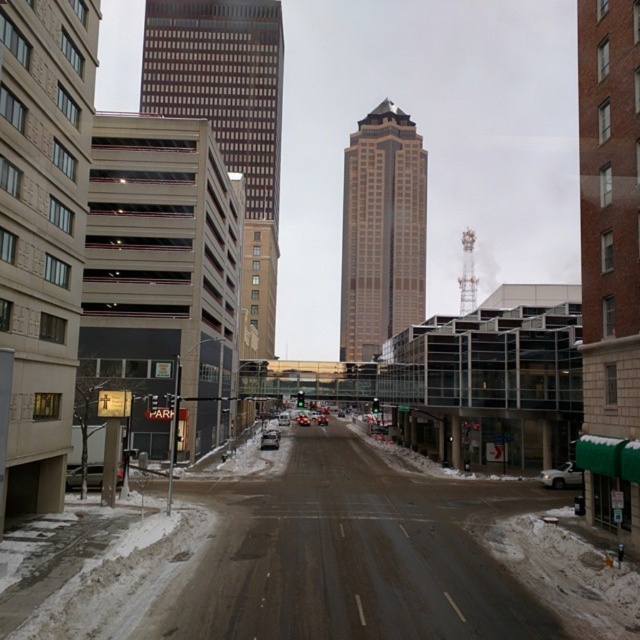
You are a city planner assessing the street layout. Given the gold glass skyscraper at center and the silver metallic sedan at center, which object occupies more horizontal space along the street?

The gold glass skyscraper at center is wider than the silver metallic sedan at center, so it occupies more horizontal space along the street.

You are a pedestrian standing on the sidewalk and want to take a photo of the gold glass skyscraper at center and the silver metallic sedan at center from the same spot. Can you do this without moving your position?

The gold glass skyscraper at center is located above the silver metallic sedan at center, so yes, you can take a photo of both from the same spot without moving since they are vertically aligned.

You are a drone operator trying to deliver a package to the brown glass skyscraper at center. The delivery system requires knowing the exact coordinates of the skyscraper. What are the coordinates provided in the image description?

The brown glass skyscraper at center is located at point (228, 116).